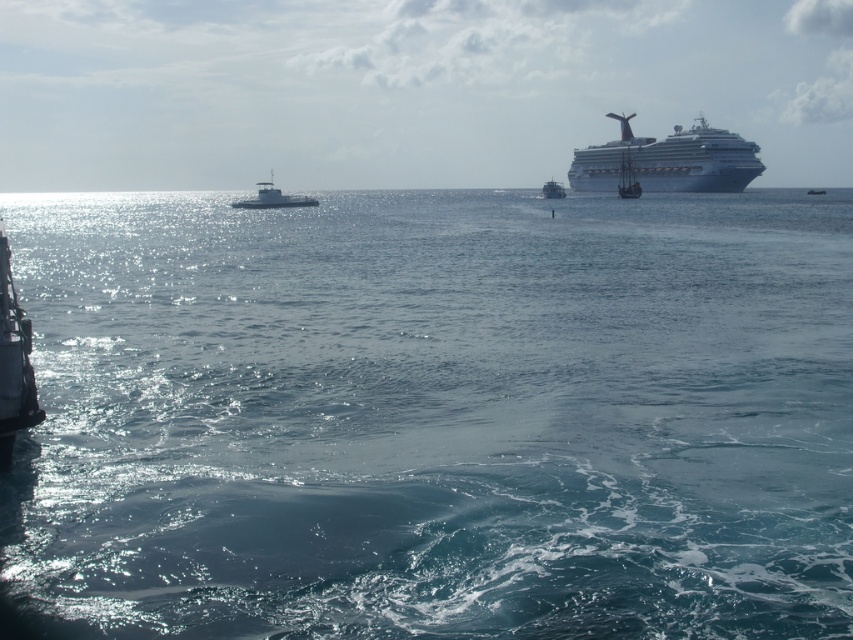
You are a photographer planning to capture the white glossy cruise ship at upper right and the white glossy sailboat at center in a single frame. Based on their sizes in the scene, which vessel will appear larger in your photo?

The white glossy cruise ship at upper right will appear larger in the photo because it is taller than the white glossy sailboat at center.

From the picture: You are a photographer planning to capture both the white glossy cruise ship at upper right and the metallic gray boat at center in a single frame. Based on their heights, which one will appear taller in the photo?

The metallic gray boat at center will appear taller in the photo because the white glossy cruise ship at upper right is not as tall as metallic gray boat at center.